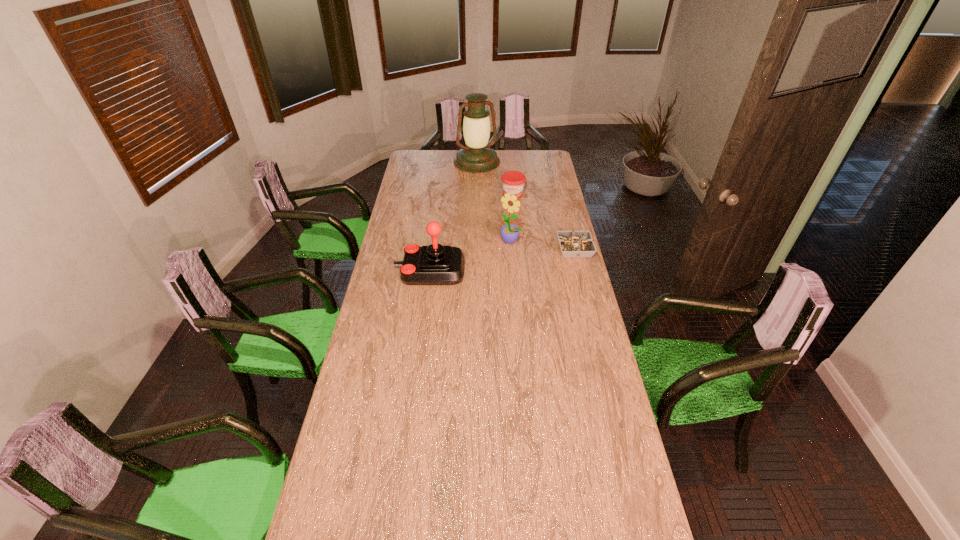
Find the location of a particular element. Image resolution: width=960 pixels, height=540 pixels. vacant region between the ashtray and the farthest object is located at coordinates (526, 205).

Identify the location of free point between the ashtray and the lantern. (526, 205).

Identify the location of free area in between the joystick and the ashtray. (502, 260).

You are a GUI agent. You are given a task and a screenshot of the screen. Output one action in this format:
    pyautogui.click(x=<x>, y=<y>)
    Task: Click on the free area in between the ashtray and the lantern
    The image size is (960, 540).
    Given the screenshot: What is the action you would take?
    pyautogui.click(x=526, y=205)

This screenshot has height=540, width=960. I want to click on free space between the sunflower and the shortest object, so click(542, 245).

Image resolution: width=960 pixels, height=540 pixels. In order to click on empty space between the fourth nearest object and the tallest object in this screenshot , I will do `click(494, 178)`.

Locate an element on the screen. free space between the ashtray and the sunflower is located at coordinates (542, 245).

Identify the location of object that stands as the second closest to the fourth nearest object. pos(509,233).

Locate which object is the second closest to the ashtray. Please provide its 2D coordinates. Your answer should be formatted as a tuple, i.e. [(x, y)], where the tuple contains the x and y coordinates of a point satisfying the conditions above.

[(513, 182)]

Locate an element on the screen. This screenshot has width=960, height=540. free spot that satisfies the following two spatial constraints: 1. on the front side of the ashtray; 2. on the right side of the farthest object is located at coordinates (476, 249).